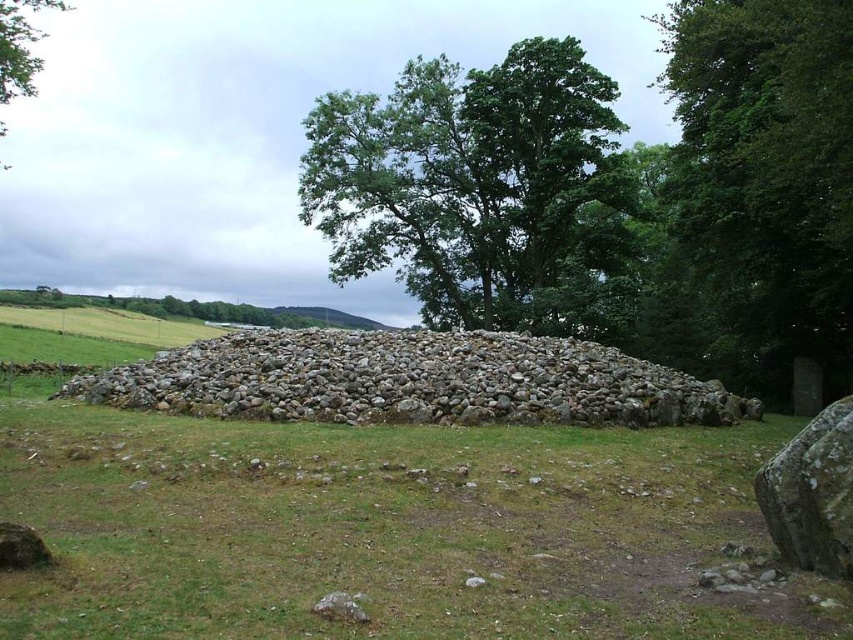
Question: Is green leafy tree at upper center to the left of gray stone pile at center from the viewer's perspective?

Choices:
 (A) no
 (B) yes

Answer: (B)

Question: Which object is positioned farthest from the green leafy tree at upper left?

Choices:
 (A) green leafy tree at right
 (B) green leafy tree at upper center

Answer: (A)

Question: Based on their relative distances, which object is farther from the green leafy tree at upper left?

Choices:
 (A) green leafy tree at right
 (B) green leafy tree at upper center

Answer: (A)

Question: Is gray stone pile at center to the left of green leafy tree at upper left from the viewer's perspective?

Choices:
 (A) no
 (B) yes

Answer: (A)

Question: Can you confirm if green leafy tree at upper center is positioned above green leafy tree at right?

Choices:
 (A) yes
 (B) no

Answer: (B)

Question: Which point is closer to the camera taking this photo?

Choices:
 (A) (494, 86)
 (B) (22, 35)

Answer: (B)